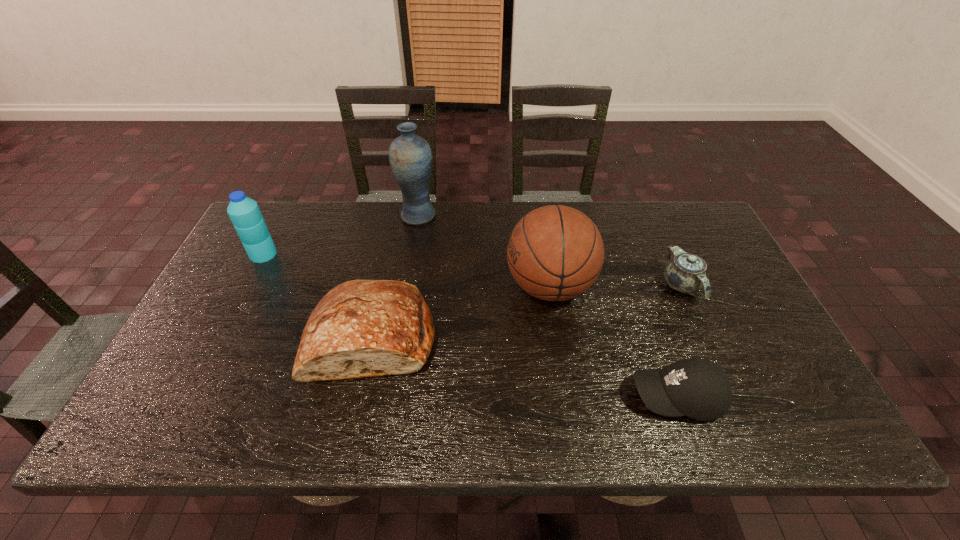
The width and height of the screenshot is (960, 540). I want to click on vacant space situated 0.290m on the side with brand label of the fourth object from left to right, so click(x=401, y=286).

I want to click on blank space located on the side with brand label of the fourth object from left to right, so click(x=434, y=286).

You are a GUI agent. You are given a task and a screenshot of the screen. Output one action in this format:
    pyautogui.click(x=<x>, y=<y>)
    Task: Click on the free region located 0.180m on the right of the leftmost object
    
    Given the screenshot: What is the action you would take?
    pyautogui.click(x=336, y=254)

The height and width of the screenshot is (540, 960). In order to click on vacant space situated at the sliced front of the bread in this screenshot , I will do `click(355, 421)`.

This screenshot has height=540, width=960. I want to click on free space located from the spout of the chinaware, so click(720, 373).

What are the coordinates of `free space located on the front-facing side of the baseball cap` in the screenshot? It's located at (581, 397).

The image size is (960, 540). What are the coordinates of `free spot located 0.240m on the front-facing side of the baseball cap` in the screenshot? It's located at (522, 397).

Image resolution: width=960 pixels, height=540 pixels. In order to click on vacant space positioned 0.330m on the front-facing side of the baseball cap in this screenshot , I will do (x=483, y=397).

Identify the location of vase that is at the far edge. This screenshot has width=960, height=540. (410, 156).

The image size is (960, 540). I want to click on water bottle that is positioned at the far edge, so click(244, 212).